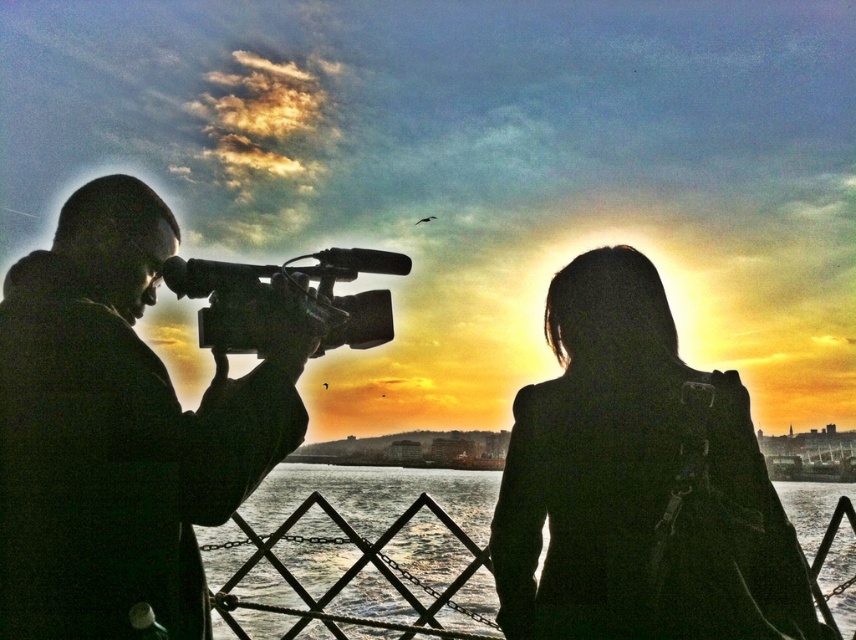
Question: Does black matte camera at left appear on the right side of black matte coat at upper right?

Choices:
 (A) yes
 (B) no

Answer: (B)

Question: Is black matte camera at left to the left of silhouette camera at left from the viewer's perspective?

Choices:
 (A) yes
 (B) no

Answer: (B)

Question: Which point appears farthest from the camera in this image?

Choices:
 (A) (165, 284)
 (B) (180, 502)
 (C) (524, 506)
 (D) (367, 588)

Answer: (D)

Question: Among these objects, which one is farthest from the camera?

Choices:
 (A) silhouette camera at left
 (B) black matte camera at left
 (C) black plastic video camera at left

Answer: (C)

Question: Which point is closer to the camera?

Choices:
 (A) (253, 298)
 (B) (355, 480)

Answer: (A)

Question: Is translucent glass water at center thinner than black plastic video camera at left?

Choices:
 (A) yes
 (B) no

Answer: (B)